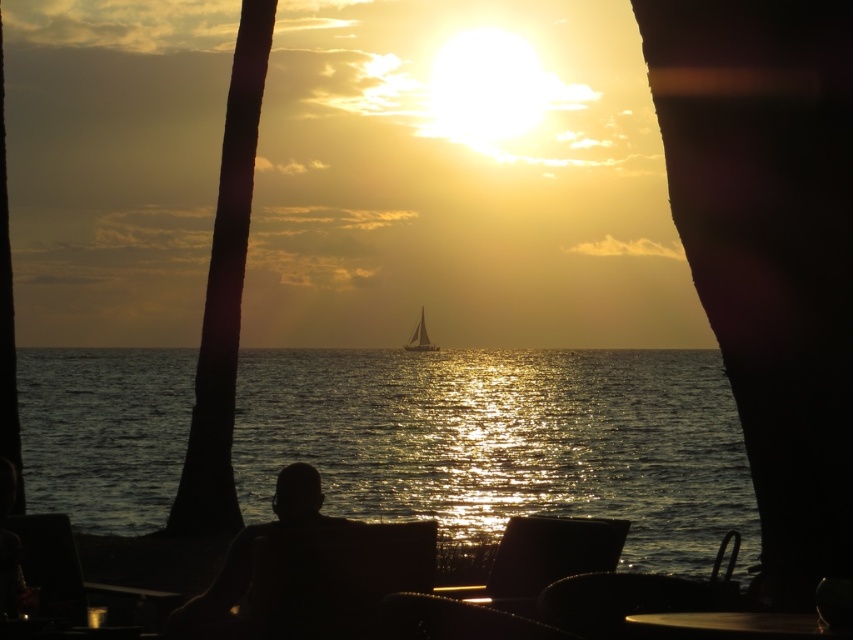
Question: Is silhouette wood palm tree at left bigger than black leather chair at center?

Choices:
 (A) yes
 (B) no

Answer: (A)

Question: Among these points, which one is farthest from the camera?

Choices:
 (A) (329, 516)
 (B) (740, 561)
 (C) (506, 556)

Answer: (B)

Question: Does glossy wooden table at center appear on the right side of silvery reflective sailboat at center?

Choices:
 (A) yes
 (B) no

Answer: (A)

Question: Estimate the real-world distances between objects in this image. Which object is closer to the black leather chair at lower center?

Choices:
 (A) glistening water at center
 (B) silhouette wood palm tree at left

Answer: (B)

Question: Which of the following is the closest to the observer?

Choices:
 (A) (80, 516)
 (B) (424, 348)
 (C) (263, 524)
 (D) (563, 529)

Answer: (C)

Question: Can you confirm if glossy wooden table at center is positioned below silvery reflective sailboat at center?

Choices:
 (A) yes
 (B) no

Answer: (B)